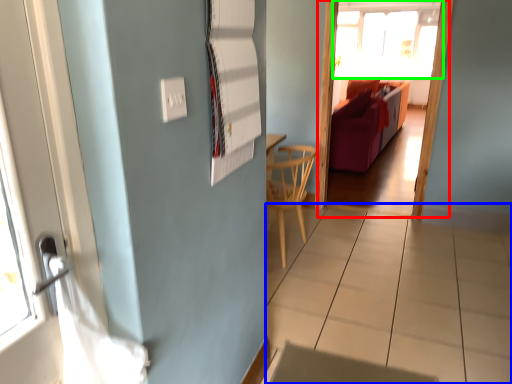
Question: Which object is the closest to the screen door (highlighted by a red box)? Choose among these: tile (highlighted by a blue box) or window (highlighted by a green box).

Choices:
 (A) tile
 (B) window

Answer: (A)